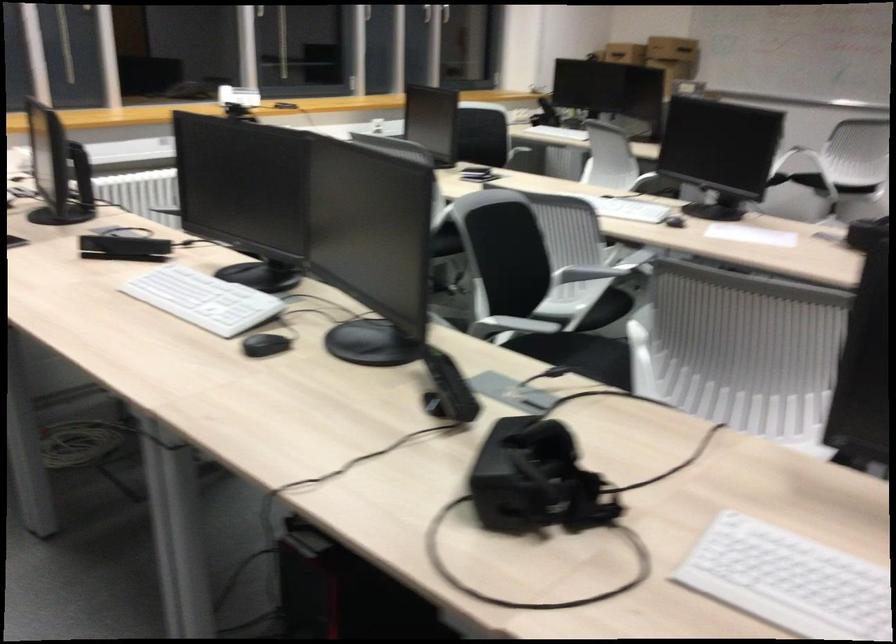
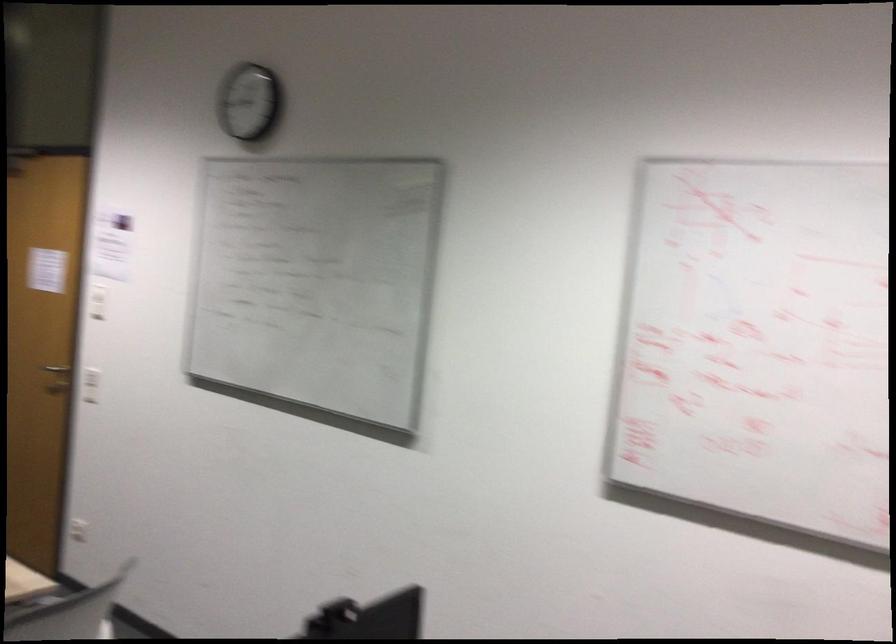
Question: How did the camera likely rotate?

Choices:
 (A) Left
 (B) Right
 (C) Up
 (D) Down

Answer: (B)